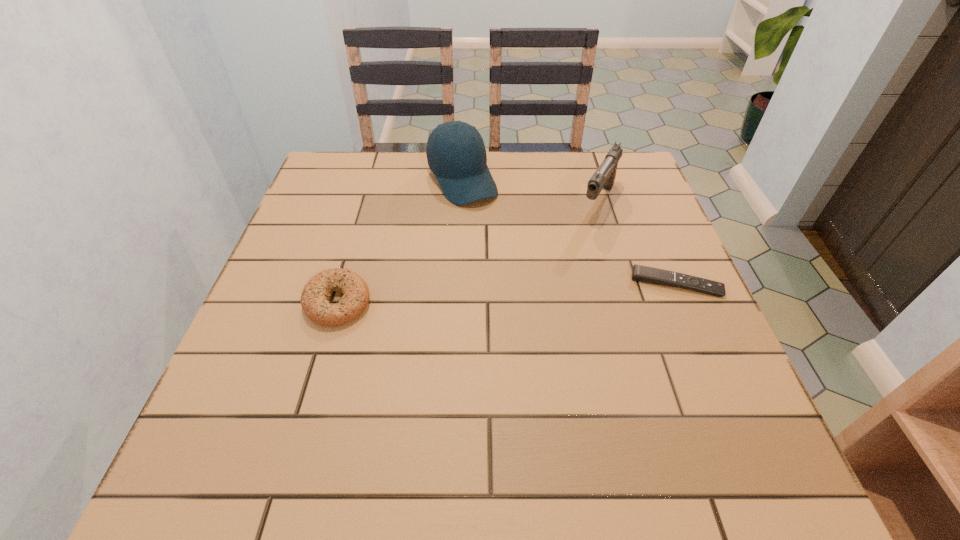
The height and width of the screenshot is (540, 960). Find the location of `vacant space on the desktop that is between the leftmost object and the remote control and is positioned in the direction the gun is aimed`. vacant space on the desktop that is between the leftmost object and the remote control and is positioned in the direction the gun is aimed is located at coordinates (543, 291).

The height and width of the screenshot is (540, 960). Find the location of `free space on the desktop that is between the leftmost object and the shortest object and is positioned on the front-facing side of the second object from left to right`. free space on the desktop that is between the leftmost object and the shortest object and is positioned on the front-facing side of the second object from left to right is located at coordinates (540, 291).